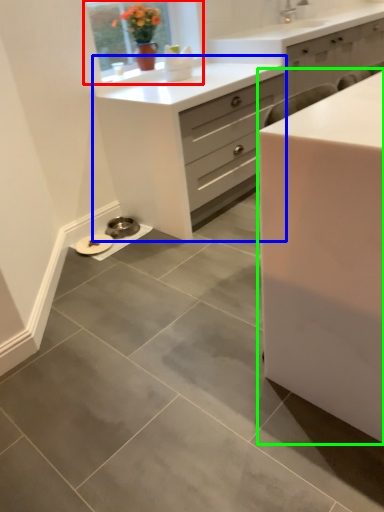
Question: Which object is the closest to the window (highlighted by a red box)? Choose among these: chest of drawers (highlighted by a blue box) or chest of drawers (highlighted by a green box).

Choices:
 (A) chest of drawers
 (B) chest of drawers

Answer: (A)